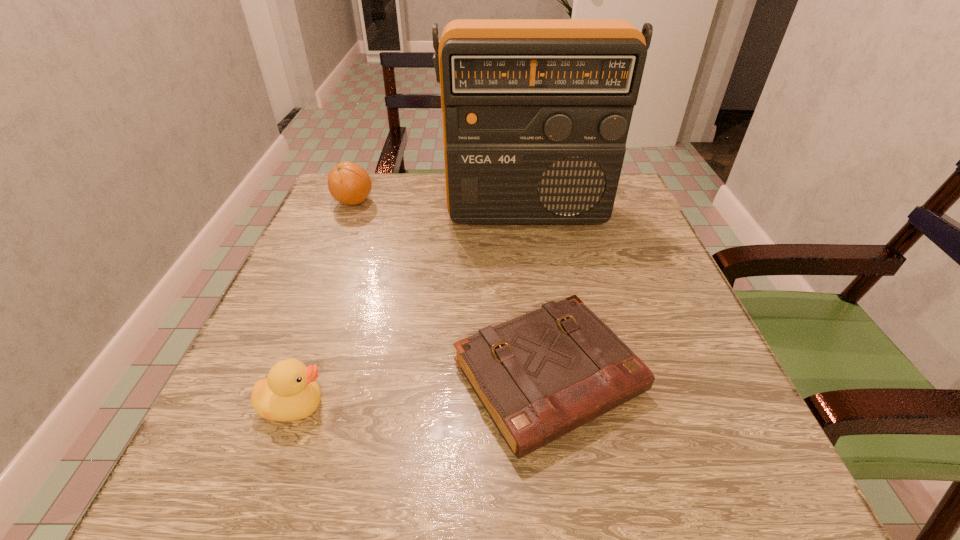
In the image, there is a desktop. Where is `vacant space at the far left corner`? This screenshot has width=960, height=540. vacant space at the far left corner is located at coordinates (336, 205).

You are a GUI agent. You are given a task and a screenshot of the screen. Output one action in this format:
    pyautogui.click(x=<x>, y=<y>)
    Task: Click on the vacant space at the near left corner of the desktop
    Image resolution: width=960 pixels, height=540 pixels.
    Given the screenshot: What is the action you would take?
    pyautogui.click(x=216, y=477)

You are a GUI agent. You are given a task and a screenshot of the screen. Output one action in this format:
    pyautogui.click(x=<x>, y=<y>)
    Task: Click on the free region at the far right corner
    
    Given the screenshot: What is the action you would take?
    pyautogui.click(x=621, y=182)

At what (x,y) coordinates should I click in order to perform the action: click on vacant space at the near right corner. Please return your answer as a coordinate pair (x, y). The height and width of the screenshot is (540, 960). Looking at the image, I should click on 672,478.

Locate an element on the screen. Image resolution: width=960 pixels, height=540 pixels. free space that is in between the radio receiver and the hardback book is located at coordinates (538, 296).

Locate an element on the screen. The height and width of the screenshot is (540, 960). free area in between the orange and the duck is located at coordinates 324,303.

Identify the location of free space between the orange and the hardback book. (451, 289).

Where is `empty space that is in between the orange and the duck`? empty space that is in between the orange and the duck is located at coordinates (324, 303).

At what (x,y) coordinates should I click in order to perform the action: click on vacant area that lies between the orange and the duck. Please return your answer as a coordinate pair (x, y). The height and width of the screenshot is (540, 960). Looking at the image, I should click on (324, 303).

Where is `vacant area that lies between the radio receiver and the orange`? vacant area that lies between the radio receiver and the orange is located at coordinates (440, 208).